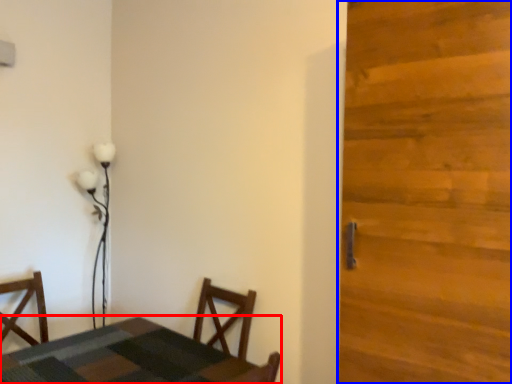
Question: Which of the following is the closest to the observer, table (highlighted by a red box) or door (highlighted by a blue box)?

Choices:
 (A) table
 (B) door

Answer: (B)